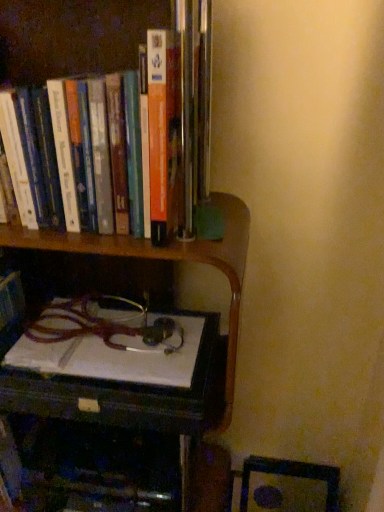
Question: Would you consider wooden desk at lower center to be distant from hardcover books at upper left?

Choices:
 (A) no
 (B) yes

Answer: (A)

Question: Is wooden desk at lower center wider than hardcover books at upper left?

Choices:
 (A) no
 (B) yes

Answer: (B)

Question: Is wooden desk at lower center aimed at hardcover books at upper left?

Choices:
 (A) yes
 (B) no

Answer: (B)

Question: Would you say wooden desk at lower center contains hardcover books at upper left?

Choices:
 (A) no
 (B) yes

Answer: (A)

Question: Can you confirm if wooden desk at lower center is bigger than hardcover books at upper left?

Choices:
 (A) no
 (B) yes

Answer: (A)

Question: Relative to wooden table at lower left, is hardcover books at upper left in front or behind?

Choices:
 (A) behind
 (B) front

Answer: (B)

Question: Looking at their shapes, would you say hardcover books at upper left is wider or thinner than wooden table at lower left?

Choices:
 (A) wide
 (B) thin

Answer: (B)

Question: Is hardcover books at upper left taller or shorter than wooden table at lower left?

Choices:
 (A) tall
 (B) short

Answer: (A)

Question: Does point (127, 62) appear closer or farther from the camera than point (34, 406)?

Choices:
 (A) farther
 (B) closer

Answer: (B)

Question: Is wooden table at lower left taller or shorter than wooden desk at lower center?

Choices:
 (A) short
 (B) tall

Answer: (B)

Question: Does point (46, 439) appear closer or farther from the camera than point (168, 245)?

Choices:
 (A) farther
 (B) closer

Answer: (A)

Question: Would you say wooden table at lower left is to the left or to the right of wooden desk at lower center in the picture?

Choices:
 (A) right
 (B) left

Answer: (B)

Question: From a real-world perspective, is wooden table at lower left physically located above or below wooden desk at lower center?

Choices:
 (A) above
 (B) below

Answer: (B)

Question: From a real-world perspective, relative to hardcover books at upper left, is wooden bookcase at upper left vertically above or below?

Choices:
 (A) above
 (B) below

Answer: (B)

Question: Is wooden bookcase at upper left situated inside hardcover books at upper left or outside?

Choices:
 (A) inside
 (B) outside

Answer: (B)